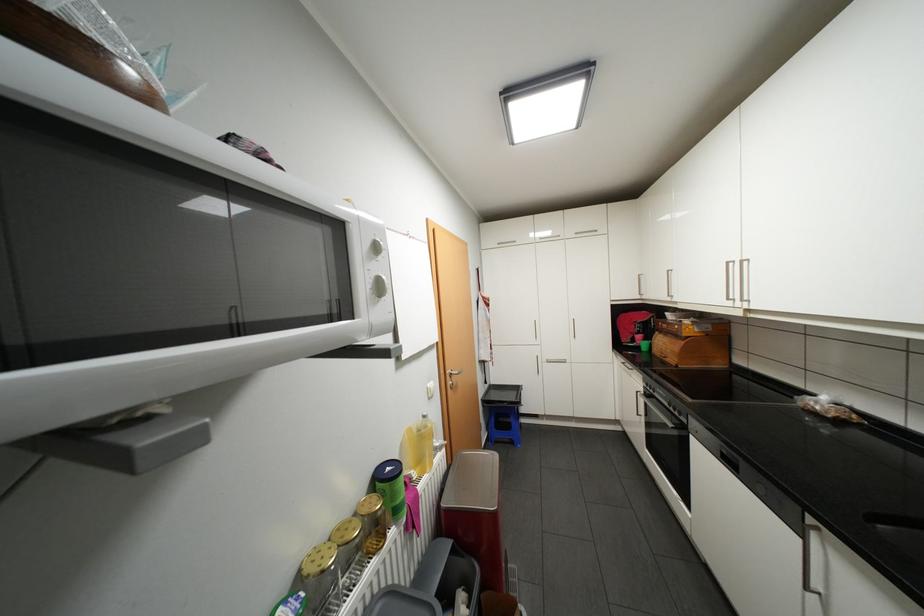
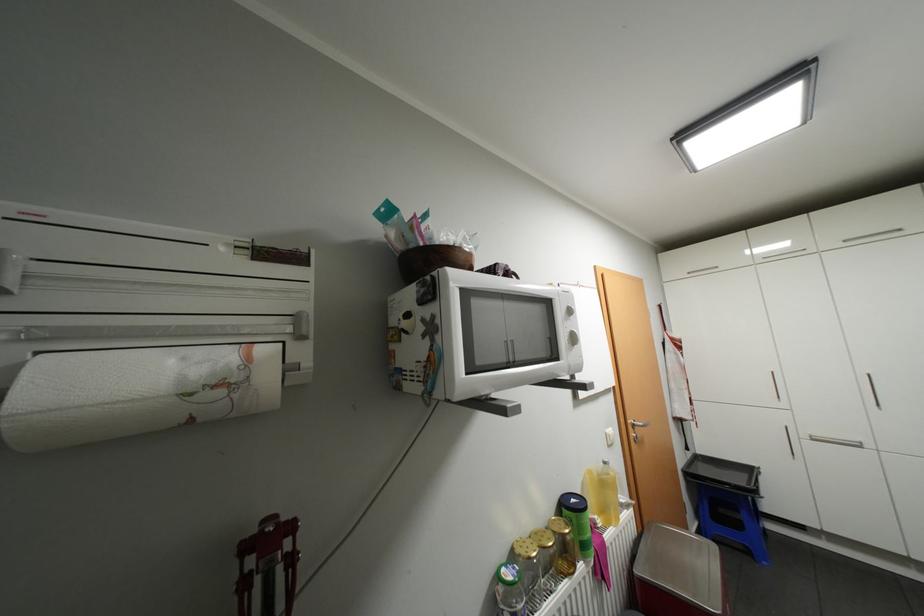
Where in the second image is the point corresponding to (x=422, y=474) from the first image?

(606, 521)